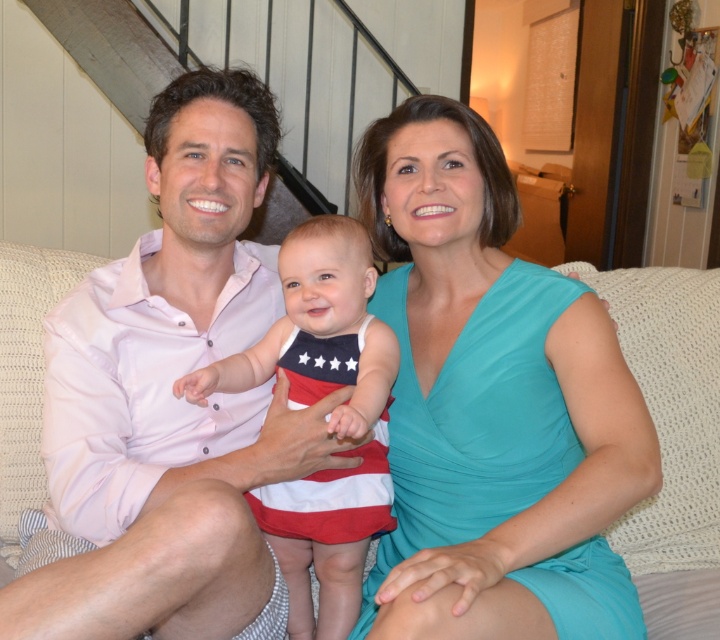
Question: Is white woven couch at center wider than american flag fabric dress at center?

Choices:
 (A) no
 (B) yes

Answer: (B)

Question: Which point is closer to the camera?

Choices:
 (A) american flag fabric dress at center
 (B) white woven couch at center
 (C) teal satin dress at center

Answer: (C)

Question: Which point is farther to the camera?

Choices:
 (A) american flag fabric dress at center
 (B) teal satin dress at center

Answer: (A)

Question: Does teal satin dress at center have a lesser width compared to pink cotton shirt at center?

Choices:
 (A) no
 (B) yes

Answer: (B)

Question: Which object appears farthest from the camera in this image?

Choices:
 (A) white woven couch at center
 (B) teal satin dress at center

Answer: (A)

Question: Observing the image, what is the correct spatial positioning of teal satin dress at center in reference to pink cotton shirt at center?

Choices:
 (A) right
 (B) left

Answer: (A)